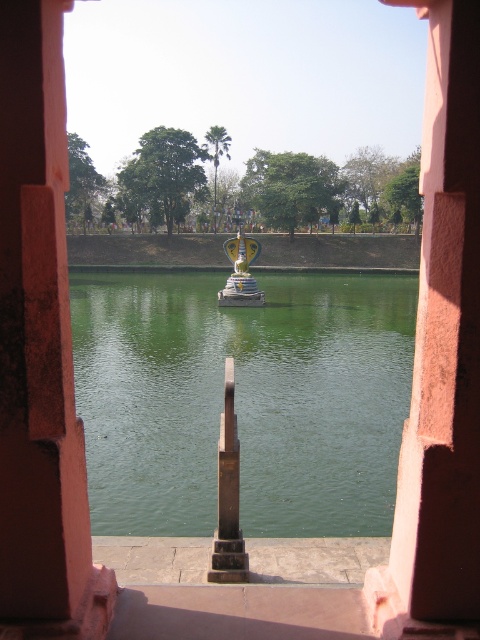
You are an architect designing a new garden layout and want to incorporate both the green smooth water at center and the smooth pink stone pillar at center. Based on their heights, which one should be placed higher up in the garden elevation?

The green smooth water at center has a greater height compared to the smooth pink stone pillar at center, so it should be placed higher up in the garden elevation.

Looking at this image, you are an architect designing a new garden layout. You need to place a decorative statue that is 3 meters wide between the green smooth water at center and the smooth pink stone pillar at center. Can the space between them accommodate the statue?

The green smooth water at center is wider than the smooth pink stone pillar at center. Since the statue is 3 meters wide, the space between them may be sufficient, but the exact width of the space isn

You are standing inside a room with pinkish walls and looking through the window. There is a point marked at coordinates (242, 400). What is located at that point?

The green smooth water at center is located at point (242, 400).